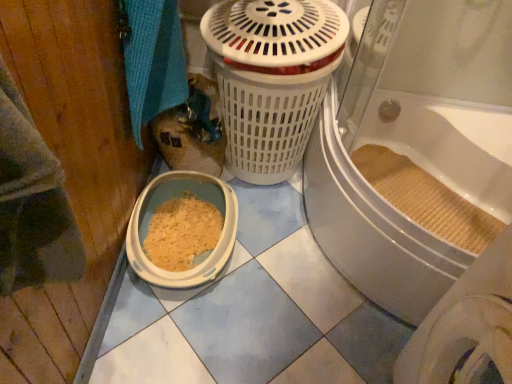
I want to click on blue woven towel at upper left, so click(x=153, y=60).

This screenshot has width=512, height=384. Describe the element at coordinates (426, 199) in the screenshot. I see `beige woven mat at bathtub` at that location.

You are a GUI agent. You are given a task and a screenshot of the screen. Output one action in this format:
    pyautogui.click(x=<x>, y=<y>)
    Task: Click on the blue woven towel at upper left
    
    Given the screenshot: What is the action you would take?
    pyautogui.click(x=153, y=60)

Locate an element on the screen. debris below the white textured bath at center (from a real-world perspective) is located at coordinates (426, 199).

How many degrees apart are the facing directions of beige woven mat at bathtub and white textured bath at center?

The facing directions of beige woven mat at bathtub and white textured bath at center are 47.3 degrees apart.

Is beige woven mat at bathtub inside or outside of white textured bath at center?

beige woven mat at bathtub is contained in white textured bath at center.

Is point (197, 176) positioned after point (377, 156)?

No, (197, 176) is in front of (377, 156).

Considering the sizes of white plastic litter box at lower left and beige woven mat at bathtub in the image, is white plastic litter box at lower left bigger or smaller than beige woven mat at bathtub?

In the image, white plastic litter box at lower left appears to be larger than beige woven mat at bathtub.

Considering the sizes of white plastic litter box at lower left and beige woven mat at bathtub in the image, is white plastic litter box at lower left wider or thinner than beige woven mat at bathtub?

In the image, white plastic litter box at lower left appears to be wider than beige woven mat at bathtub.

Where is `debris below the white textured bath at center (from the image's perspective)`? The width and height of the screenshot is (512, 384). debris below the white textured bath at center (from the image's perspective) is located at coordinates (426, 199).

Are white textured bath at center and beige woven mat at bathtub making contact?

white textured bath at center and beige woven mat at bathtub are not in contact.

Looking at this image, does white textured bath at center turn towards beige woven mat at bathtub?

No, white textured bath at center is not aimed at beige woven mat at bathtub.

Does white textured bath at center lie behind beige woven mat at bathtub?

No, it is not.

Considering the relative sizes of white plastic litter box at lower left and blue woven towel at upper left in the image provided, is white plastic litter box at lower left shorter than blue woven towel at upper left?

Correct, white plastic litter box at lower left is not as tall as blue woven towel at upper left.

Which object is wider, white plastic litter box at lower left or blue woven towel at upper left?

Wider between the two is white plastic litter box at lower left.

The image size is (512, 384). I want to click on toilet behind the blue woven towel at upper left, so click(176, 198).

From a real-world perspective, is white plastic litter box at lower left positioned under white textured bath at center based on gravity?

Correct, in the physical world, white plastic litter box at lower left is lower than white textured bath at center.

Is point (150, 210) closer or farther from the camera than point (505, 120)?

Point (150, 210) is positioned closer to the camera compared to point (505, 120).

What's the angular difference between white plastic litter box at lower left and white textured bath at center's facing directions?

The facing directions of white plastic litter box at lower left and white textured bath at center are 90 degrees apart.

Is beige woven mat at bathtub taller or shorter than white plastic litter box at lower left?

In the image, beige woven mat at bathtub appears to be shorter than white plastic litter box at lower left.

Is beige woven mat at bathtub directly adjacent to white plastic litter box at lower left?

They are not placed beside each other.

From a real-world perspective, does beige woven mat at bathtub sit lower than white plastic litter box at lower left?

No, from a real-world perspective, beige woven mat at bathtub is not beneath white plastic litter box at lower left.

The height and width of the screenshot is (384, 512). In the image, there is a white textured bath at center. What are the coordinates of `bath towel above it (from the image's perspective)` in the screenshot? It's located at (153, 60).

Are white textured bath at center and blue woven towel at upper left beside each other?

No, white textured bath at center is not making contact with blue woven towel at upper left.

In terms of size, does white textured bath at center appear bigger or smaller than blue woven towel at upper left?

Considering their sizes, white textured bath at center takes up more space than blue woven towel at upper left.

How different are the orientations of white textured bath at center and blue woven towel at upper left in degrees?

The angle between the facing direction of white textured bath at center and the facing direction of blue woven towel at upper left is 90 degrees.

Image resolution: width=512 pixels, height=384 pixels. Find the location of `bath above the beige woven mat at bathtub (from the image's perspective)`. bath above the beige woven mat at bathtub (from the image's perspective) is located at coordinates (372, 230).

Locate an element on the screen. debris to the right of white plastic litter box at lower left is located at coordinates (426, 199).

In the scene shown: Based on their spatial positions, is beige woven mat at bathtub or blue woven towel at upper left further from white plastic litter box at lower left?

Based on the image, beige woven mat at bathtub appears to be further to white plastic litter box at lower left.

Which object lies nearer to the anchor point blue woven towel at upper left, beige woven mat at bathtub or white textured bath at center?

white textured bath at center is closer to blue woven towel at upper left.

Looking at the image, which one is located closer to beige woven mat at bathtub, white textured bath at center or blue woven towel at upper left?

white textured bath at center.

Which object lies nearer to the anchor point white textured bath at center, beige woven mat at bathtub or white plastic litter box at lower left?

Among the two, beige woven mat at bathtub is located nearer to white textured bath at center.

Looking at the image, which one is located closer to beige woven mat at bathtub, white plastic litter box at lower left or white textured bath at center?

Based on the image, white textured bath at center appears to be nearer to beige woven mat at bathtub.

When comparing their distances from white textured bath at center, does blue woven towel at upper left or beige woven mat at bathtub seem closer?

beige woven mat at bathtub lies closer to white textured bath at center than the other object.

When comparing their distances from beige woven mat at bathtub, does blue woven towel at upper left or white plastic litter box at lower left seem closer?

Based on the image, white plastic litter box at lower left appears to be nearer to beige woven mat at bathtub.

When comparing their distances from white plastic litter box at lower left, does white textured bath at center or beige woven mat at bathtub seem further?

The object further to white plastic litter box at lower left is beige woven mat at bathtub.

You are a GUI agent. You are given a task and a screenshot of the screen. Output one action in this format:
    pyautogui.click(x=<x>, y=<y>)
    Task: Click on the toilet situated between blue woven towel at upper left and white textured bath at center from left to right
    This screenshot has height=384, width=512.
    Given the screenshot: What is the action you would take?
    pyautogui.click(x=176, y=198)

Where is `toilet between blue woven towel at upper left and beige woven mat at bathtub from left to right`? This screenshot has width=512, height=384. toilet between blue woven towel at upper left and beige woven mat at bathtub from left to right is located at coordinates (176, 198).

Locate an element on the screen. The width and height of the screenshot is (512, 384). debris between white plastic litter box at lower left and white textured bath at center from left to right is located at coordinates (426, 199).

Find the location of a particular element. Image resolution: width=512 pixels, height=384 pixels. debris located between blue woven towel at upper left and white textured bath at center in the left-right direction is located at coordinates (426, 199).